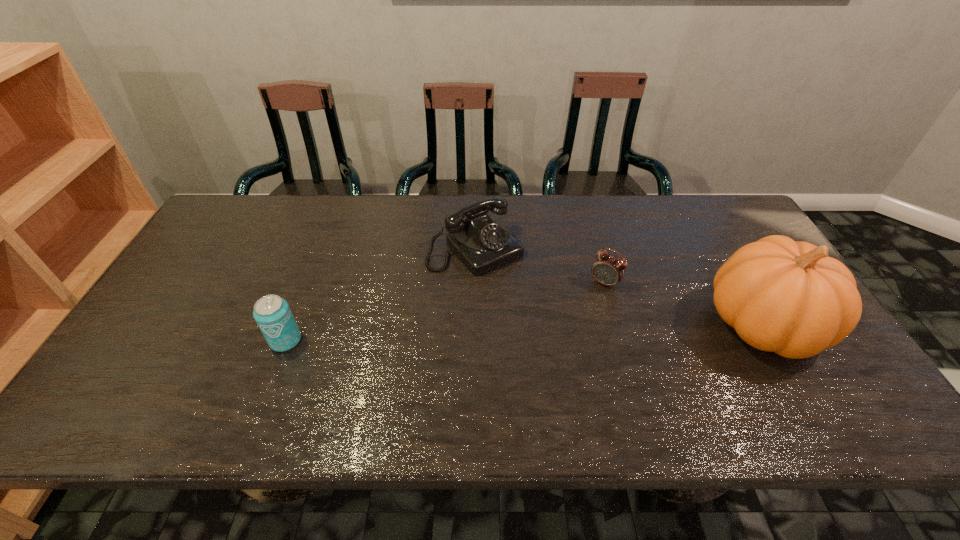
Find the location of `beer can`. beer can is located at coordinates (272, 314).

The image size is (960, 540). In order to click on the rightmost object in this screenshot , I will do `click(784, 296)`.

At what (x,y) coordinates should I click in order to perform the action: click on pumpkin. Please return your answer as a coordinate pair (x, y). Image resolution: width=960 pixels, height=540 pixels. Looking at the image, I should click on (784, 296).

Where is `alarm clock`? The width and height of the screenshot is (960, 540). alarm clock is located at coordinates (607, 269).

What are the coordinates of `telephone` in the screenshot? It's located at (482, 243).

Image resolution: width=960 pixels, height=540 pixels. I want to click on vacant space located 0.190m on the back of the leftmost object, so click(311, 276).

Identify the location of free space located 0.230m on the back of the pumpkin. (708, 231).

At what (x,y) coordinates should I click in order to perform the action: click on blank space located 0.260m on the face of the alarm clock. Please return your answer as a coordinate pair (x, y). Looking at the image, I should click on (554, 355).

Where is `blank space located on the face of the alarm clock`? blank space located on the face of the alarm clock is located at coordinates (583, 313).

You are a GUI agent. You are given a task and a screenshot of the screen. Output one action in this format:
    pyautogui.click(x=<x>, y=<y>)
    Task: Click on the vacant space located 0.080m on the face of the alarm clock
    The image size is (960, 540).
    Given the screenshot: What is the action you would take?
    pyautogui.click(x=586, y=309)